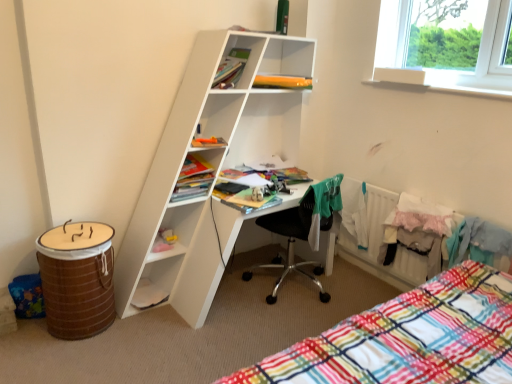
Identify the location of free space to the right of brown woven barrel at lower left. The width and height of the screenshot is (512, 384). click(x=145, y=332).